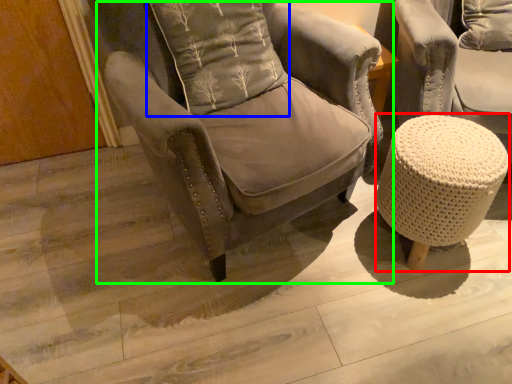
Question: Considering the real-world distances, which object is farthest from bar stool (highlighted by a red box)? pillow (highlighted by a blue box) or chair (highlighted by a green box)?

Choices:
 (A) pillow
 (B) chair

Answer: (A)